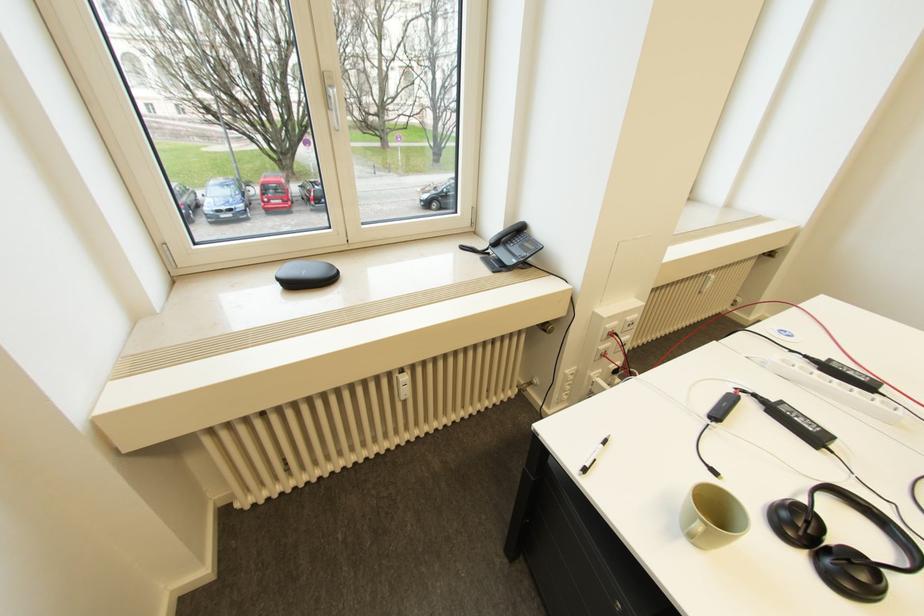
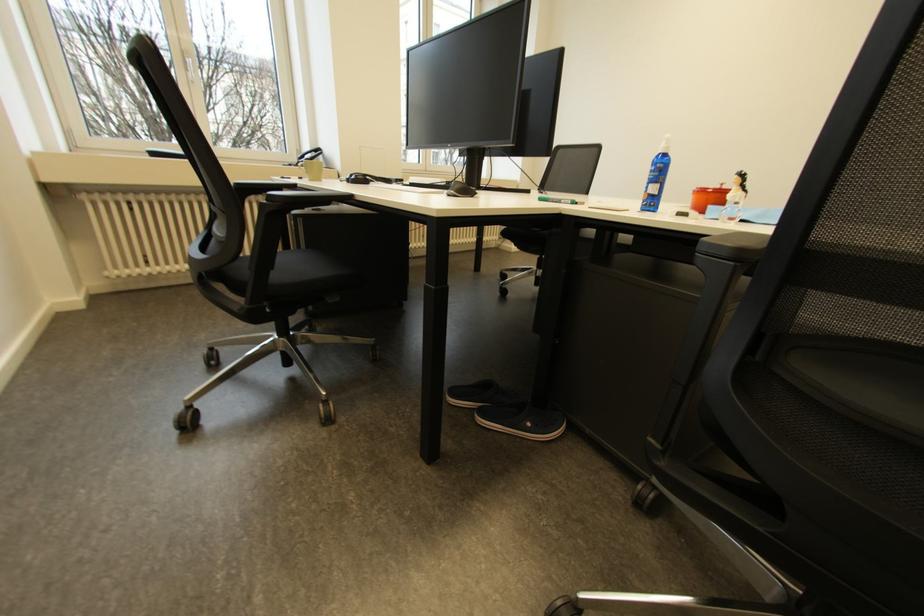
Which direction would the cameraman need to move to produce the second image?

The movement direction of the cameraman is right, backward.